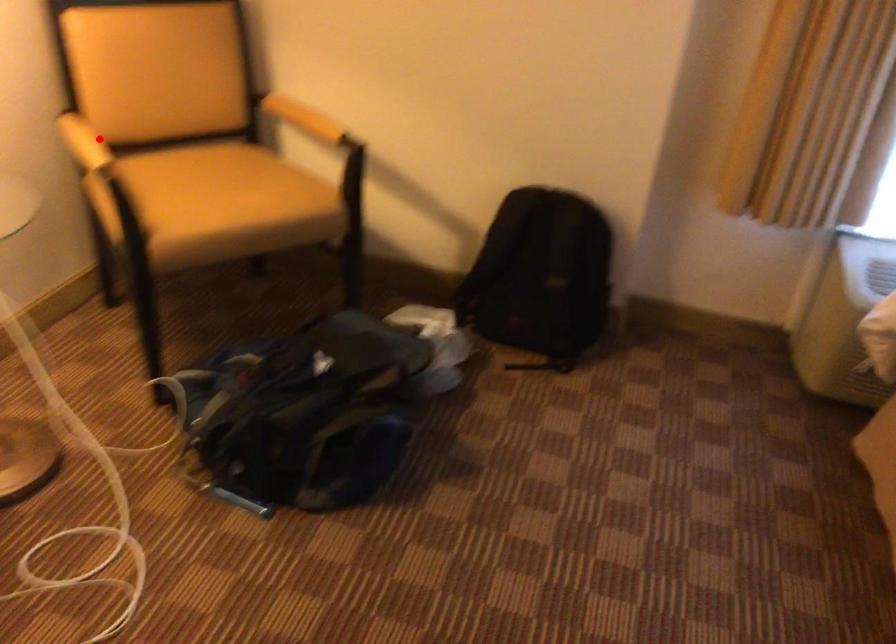
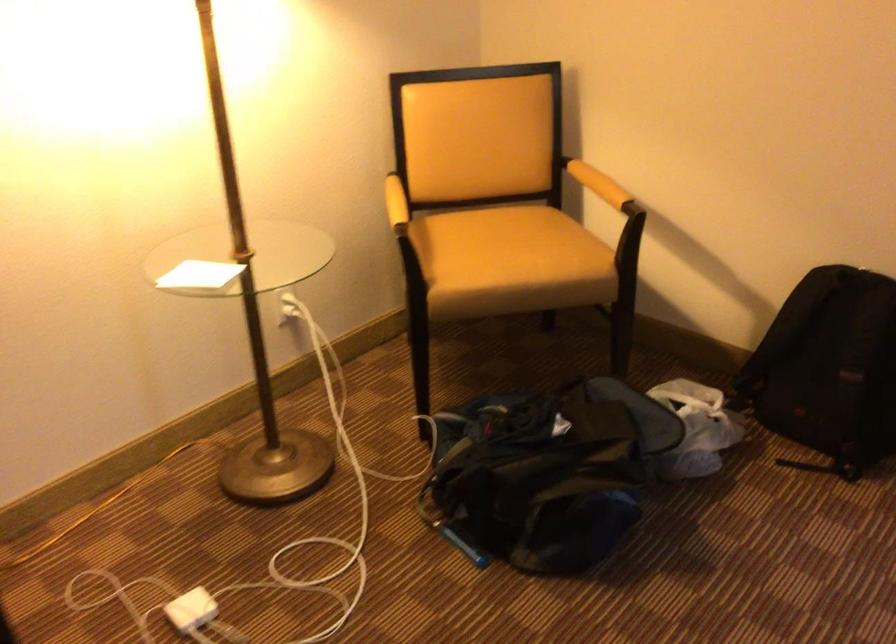
Where in the second image is the point corresponding to the highlighted location from the first image?

(395, 203)